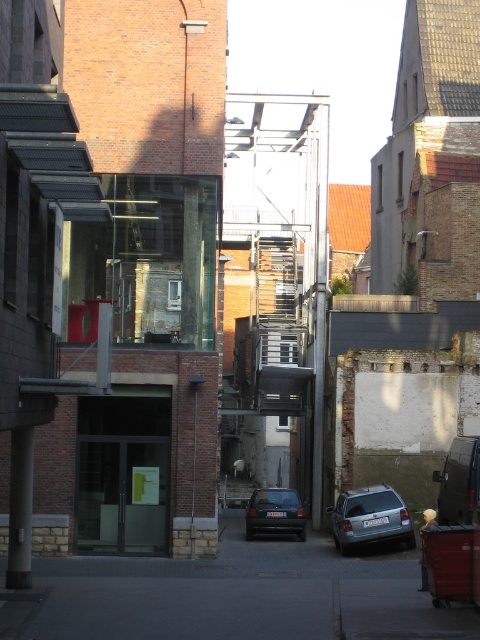
You are a delivery driver who needs to park your vehicle in the alleyway shown. The parking spot you want is at coordinates point 0.809, 0.771. Is your satin silver car at lower center currently blocking that spot?

The satin silver car at lower center is located at point [370,516], so yes, it is blocking the parking spot at that coordinate.

You are a delivery person trying to park your vehicle in the alleyway shown. You have two cars available, a satin silver car at lower center and a dark gray matte car at center. Based on their sizes, which car would be more suitable for navigating the narrow alleyway?

The dark gray matte car at center is more suitable for navigating the narrow alleyway because it is shorter than the satin silver car at lower center, making it easier to maneuver in tight spaces.

You are a delivery driver who needs to park your truck in the alleyway shown. The alley is narrow, and you must ensure your truck can fit between the satin silver car at lower center and the dark gray matte car at center. Your truck is 2.5 meters wide. Can you safely park your truck between them?

The satin silver car at lower center is wider than the dark gray matte car at center. Since the satin silver car at lower center is wider, the space between them may be sufficient for your truck. However, without knowing the exact distance between the cars, it is uncertain if the 2.5 meters width will fit. Consider measuring the gap before proceeding.